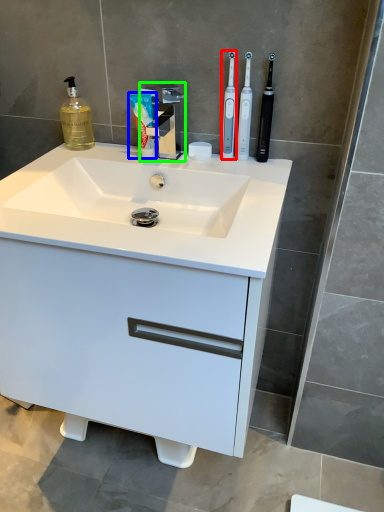
Question: Which is nearer to the toothbrush (highlighted by a red box)? toothpaste (highlighted by a blue box) or tap (highlighted by a green box).

Choices:
 (A) toothpaste
 (B) tap

Answer: (B)